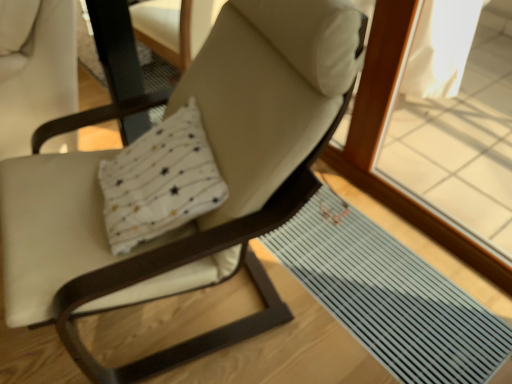
Where is `gray rubber mat at lower right`? This screenshot has height=384, width=512. gray rubber mat at lower right is located at coordinates (389, 295).

Where is `matte white swivel chair at left`? matte white swivel chair at left is located at coordinates (35, 69).

This screenshot has width=512, height=384. In order to click on matte white chair at center in this screenshot , I will do `click(219, 167)`.

Find the location of `white soft pillow at center`. white soft pillow at center is located at coordinates (160, 181).

Where is `gray rubber mat at lower right`? gray rubber mat at lower right is located at coordinates (389, 295).

Does matte white chair at center have a smaller size compared to white soft pillow at center?

Incorrect, matte white chair at center is not smaller in size than white soft pillow at center.

Does point (179, 96) come behind point (130, 174)?

Yes, point (179, 96) is farther from viewer.

From a real-world perspective, is matte white chair at center beneath white soft pillow at center?

Actually, matte white chair at center is physically above white soft pillow at center in the real world.

What's the angular difference between matte white chair at center and white soft pillow at center's facing directions?

The angle between the facing direction of matte white chair at center and the facing direction of white soft pillow at center is 8 degrees.

Is matte white chair at center situated inside gray rubber mat at lower right or outside?

matte white chair at center is located beyond the bounds of gray rubber mat at lower right.

Where is `mat beneath the matte white chair at center (from a real-world perspective)`? Image resolution: width=512 pixels, height=384 pixels. mat beneath the matte white chair at center (from a real-world perspective) is located at coordinates (389, 295).

Can you confirm if matte white chair at center is bigger than gray rubber mat at lower right?

Yes, matte white chair at center is bigger than gray rubber mat at lower right.

Does white soft pillow at center touch gray rubber mat at lower right?

There is a gap between white soft pillow at center and gray rubber mat at lower right.

Looking at this image, measure the distance between white soft pillow at center and gray rubber mat at lower right.

They are 27.41 inches apart.

Which is behind, white soft pillow at center or gray rubber mat at lower right?

gray rubber mat at lower right is further from the camera.

In terms of width, does white soft pillow at center look wider or thinner when compared to gray rubber mat at lower right?

In the image, white soft pillow at center appears to be more narrow than gray rubber mat at lower right.

Is gray rubber mat at lower right located within matte white swivel chair at left?

Actually, gray rubber mat at lower right is outside matte white swivel chair at left.

Where is `mat on the right of matte white swivel chair at left`? The width and height of the screenshot is (512, 384). mat on the right of matte white swivel chair at left is located at coordinates (389, 295).

Is matte white swivel chair at left facing towards gray rubber mat at lower right?

No, matte white swivel chair at left is not oriented towards gray rubber mat at lower right.

Between white soft pillow at center and matte white chair at center, which one has larger size?

matte white chair at center.

Considering the positions of point (120, 200) and point (218, 213), is point (120, 200) closer or farther from the camera than point (218, 213)?

Point (120, 200) appears to be farther away from the viewer than point (218, 213).

Can you confirm if white soft pillow at center is positioned to the right of matte white swivel chair at left?

Yes, white soft pillow at center is to the right of matte white swivel chair at left.

In the image, is white soft pillow at center positioned in front of or behind matte white swivel chair at left?

Clearly, white soft pillow at center is in front of matte white swivel chair at left.

Are white soft pillow at center and matte white swivel chair at left making contact?

No, white soft pillow at center is not touching matte white swivel chair at left.

Is white soft pillow at center positioned with its back to matte white swivel chair at left?

white soft pillow at center is not turned away from matte white swivel chair at left.

Considering the points (276, 309) and (73, 92), which point is in front, point (276, 309) or point (73, 92)?

The point (276, 309) is in front.

Is matte white chair at center turned away from matte white swivel chair at left?

No, matte white swivel chair at left is not at the back of matte white chair at center.

Which object is wider, matte white chair at center or matte white swivel chair at left?

Wider between the two is matte white chair at center.

Locate an element on the screen. chair above the white soft pillow at center (from a real-world perspective) is located at coordinates (219, 167).

This screenshot has width=512, height=384. In order to click on mat located behind the matte white chair at center in this screenshot , I will do `click(389, 295)`.

Which object lies nearer to the anchor point matte white chair at center, matte white swivel chair at left or white soft pillow at center?

white soft pillow at center.

Considering their positions, is gray rubber mat at lower right positioned closer to white soft pillow at center than matte white swivel chair at left?

matte white swivel chair at left is positioned closer to the anchor white soft pillow at center.

Which object lies further to the anchor point matte white swivel chair at left, white soft pillow at center or gray rubber mat at lower right?

Among the two, gray rubber mat at lower right is located further to matte white swivel chair at left.

Looking at the image, which one is located closer to gray rubber mat at lower right, white soft pillow at center or matte white swivel chair at left?

Among the two, white soft pillow at center is located nearer to gray rubber mat at lower right.

Based on their spatial positions, is matte white chair at center or matte white swivel chair at left further from gray rubber mat at lower right?

Answer: The object further to gray rubber mat at lower right is matte white swivel chair at left.

Based on their spatial positions, is white soft pillow at center or matte white swivel chair at left further from matte white chair at center?

matte white swivel chair at left is further to matte white chair at center.

Estimate the real-world distances between objects in this image. Which object is further from white soft pillow at center, matte white swivel chair at left or matte white chair at center?

matte white swivel chair at left.

Based on the photo, which object lies nearer to the anchor point matte white swivel chair at left, gray rubber mat at lower right or matte white chair at center?

matte white chair at center is closer to matte white swivel chair at left.

Find the location of a particular element. This screenshot has width=512, height=384. chair located between matte white swivel chair at left and gray rubber mat at lower right in the left-right direction is located at coordinates pyautogui.click(x=219, y=167).

Where is `pillow located between matte white swivel chair at left and gray rubber mat at lower right in the left-right direction`? The height and width of the screenshot is (384, 512). pillow located between matte white swivel chair at left and gray rubber mat at lower right in the left-right direction is located at coordinates (160, 181).

Image resolution: width=512 pixels, height=384 pixels. Identify the location of chair between matte white swivel chair at left and white soft pillow at center in the horizontal direction. (219, 167).

Image resolution: width=512 pixels, height=384 pixels. What are the coordinates of `pillow between matte white chair at center and gray rubber mat at lower right` in the screenshot? It's located at (160, 181).